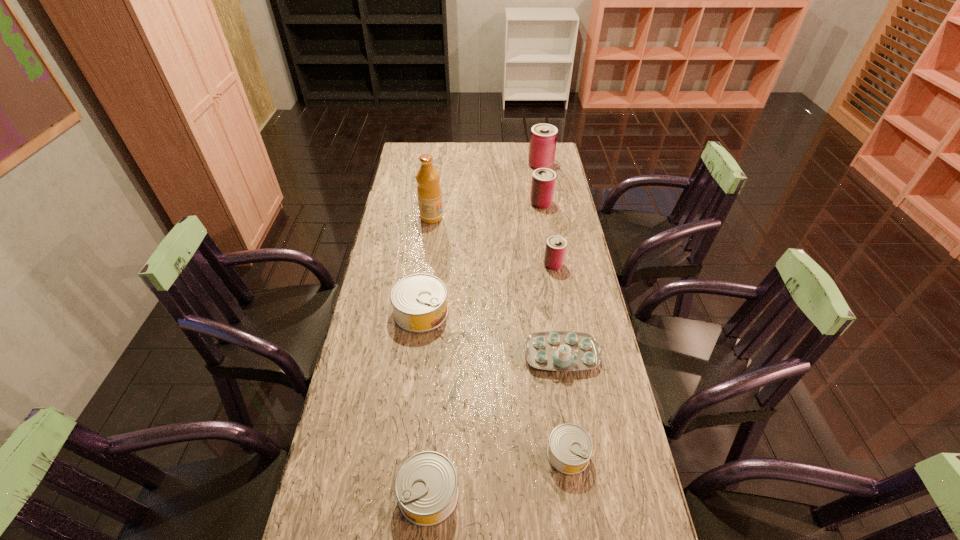
Find the location of a particular element. The image size is (960, 540). the tallest object is located at coordinates (428, 190).

This screenshot has width=960, height=540. Identify the location of fruit juice. (428, 190).

The width and height of the screenshot is (960, 540). Find the location of `the seventh shortest object`. the seventh shortest object is located at coordinates (543, 138).

Locate an element on the screen. the farthest can is located at coordinates (543, 138).

This screenshot has width=960, height=540. Identify the location of the fifth nearest can. (543, 182).

This screenshot has height=540, width=960. Find the location of `the second smallest pink can`. the second smallest pink can is located at coordinates (543, 182).

Locate an element on the screen. This screenshot has height=540, width=960. the smallest pink can is located at coordinates (555, 250).

The image size is (960, 540). Identify the location of the third farthest can. (555, 250).

Where is `the biggest silver can`? The width and height of the screenshot is (960, 540). the biggest silver can is located at coordinates (419, 301).

In order to click on the farthest silver can in this screenshot , I will do `click(419, 301)`.